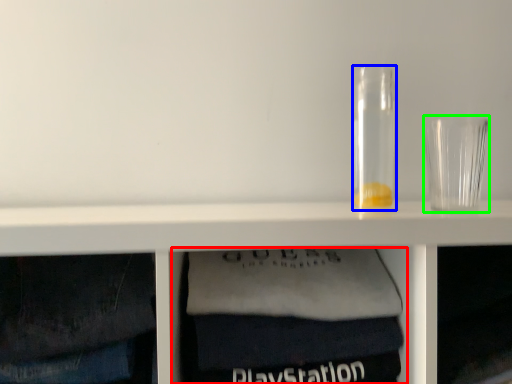
Question: Which object is the closest to the cabinet (highlighted by a red box)? Choose among these: glass jar (highlighted by a blue box) or shot glass (highlighted by a green box).

Choices:
 (A) glass jar
 (B) shot glass

Answer: (A)